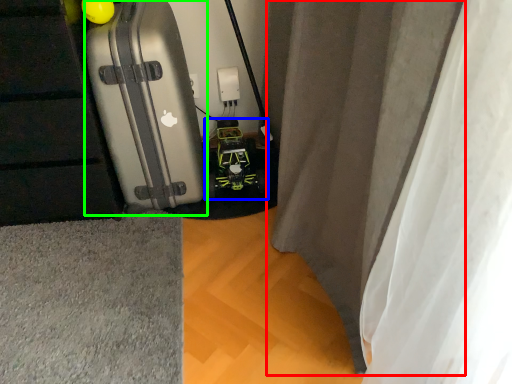
Question: Considering the real-world distances, which object is closest to curtain (highlighted by a red box)? toy car (highlighted by a blue box) or suitcase (highlighted by a green box).

Choices:
 (A) toy car
 (B) suitcase

Answer: (B)